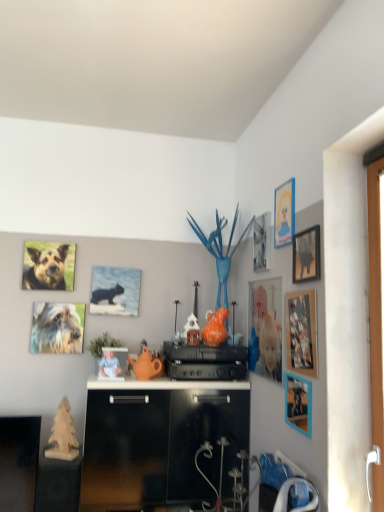
Describe the element at coordinates (46, 269) in the screenshot. The height and width of the screenshot is (512, 384). I see `brown fur dog at upper left, the 1th dog positioned from the top` at that location.

This screenshot has width=384, height=512. Find the location of `shaggy fur dog at upper left, positioned as the 2th dog in top-to-bottom order`. shaggy fur dog at upper left, positioned as the 2th dog in top-to-bottom order is located at coordinates (56, 329).

What is the approximate width of wooden picture frame at upper right, arranged as the 1th picture frame when viewed from the right?

0.86 inches.

Find the location of a particular element. black plastic stereo at center is located at coordinates point(205,361).

The image size is (384, 512). Describe the element at coordinates (265, 328) in the screenshot. I see `matte plastic picture frame at center-right, which is the 6th picture frame in right-to-left order` at that location.

The image size is (384, 512). In order to click on brown fur dog at upper left, the 1th dog positioned from the top in this screenshot , I will do `click(46, 269)`.

Consider the image. Considering the sizes of objects black plastic stereo at center and matte plastic picture frame at center-right, which is the 6th picture frame in right-to-left order, in the image provided, who is smaller, black plastic stereo at center or matte plastic picture frame at center-right, which is the 6th picture frame in right-to-left order,?

matte plastic picture frame at center-right, which is the 6th picture frame in right-to-left order, is smaller.

From a real-world perspective, is black plastic stereo at center positioned under matte plastic picture frame at center-right, the third picture frame from the left, based on gravity?

Yes.

Locate an element on the screen. The width and height of the screenshot is (384, 512). the 2nd picture frame above the black plastic stereo at center (from the image's perspective) is located at coordinates (265, 328).

Between wooden picture frame at right, arranged as the third picture frame when viewed from the right, and black plastic stereo at center, which one has larger width?

With larger width is black plastic stereo at center.

Is wooden picture frame at right, the sixth picture frame viewed from the left, directly adjacent to black plastic stereo at center?

No.

Considering the positions of points (294, 424) and (236, 365), is point (294, 424) farther from camera compared to point (236, 365)?

No.

Does wooden picture frame at right, arranged as the third picture frame when viewed from the right, have a smaller size compared to black plastic stereo at center?

Correct, wooden picture frame at right, arranged as the third picture frame when viewed from the right, occupies less space than black plastic stereo at center.

Consider the image. Which is farther, (375, 355) or (262, 243)?

The point (262, 243) is more distant.

Could you tell me if white plastic handle at right is facing metallic silver picture frame at upper right, which is counted as the fifth picture frame, starting from the right?

No, white plastic handle at right is not aimed at metallic silver picture frame at upper right, which is counted as the fifth picture frame, starting from the right.

From a real-world perspective, is white plastic handle at right over metallic silver picture frame at upper right, which is counted as the fifth picture frame, starting from the right?

Actually, white plastic handle at right is physically below metallic silver picture frame at upper right, which is counted as the fifth picture frame, starting from the right, in the real world.

Could you tell me if metallic silver picture frame at upper right, which is the fourth picture frame from left to right, is facing matte plastic picture frame at center, which is the 7th picture frame from right to left?

No, metallic silver picture frame at upper right, which is the fourth picture frame from left to right, does not turn towards matte plastic picture frame at center, which is the 7th picture frame from right to left.

Is metallic silver picture frame at upper right, which is counted as the fifth picture frame, starting from the right, bigger than matte plastic picture frame at center, which is the 7th picture frame from right to left?

Incorrect, metallic silver picture frame at upper right, which is counted as the fifth picture frame, starting from the right, is not larger than matte plastic picture frame at center, which is the 7th picture frame from right to left.

Can you confirm if metallic silver picture frame at upper right, which is counted as the fifth picture frame, starting from the right, is wider than matte plastic picture frame at center, which is the 7th picture frame from right to left?

Incorrect, the width of metallic silver picture frame at upper right, which is counted as the fifth picture frame, starting from the right, does not surpass that of matte plastic picture frame at center, which is the 7th picture frame from right to left.

How far apart are metallic silver picture frame at upper right, which is counted as the fifth picture frame, starting from the right, and matte plastic picture frame at center, which is the 7th picture frame from right to left?

metallic silver picture frame at upper right, which is counted as the fifth picture frame, starting from the right, is 1.02 meters away from matte plastic picture frame at center, which is the 7th picture frame from right to left.

Between shaggy fur dog at upper left, marked as the first dog in a bottom-to-top arrangement, and matte plastic picture frame at center-right, which is the 6th picture frame in right-to-left order, which one has smaller width?

matte plastic picture frame at center-right, which is the 6th picture frame in right-to-left order.

Can you confirm if shaggy fur dog at upper left, positioned as the 2th dog in top-to-bottom order, is smaller than matte plastic picture frame at center-right, which is the 6th picture frame in right-to-left order?

Indeed, shaggy fur dog at upper left, positioned as the 2th dog in top-to-bottom order, has a smaller size compared to matte plastic picture frame at center-right, which is the 6th picture frame in right-to-left order.

Is point (60, 313) closer or farther from the camera than point (256, 303)?

Point (60, 313) is farther from the camera than point (256, 303).

Looking at this image, from a real-world perspective, is shaggy fur dog at upper left, marked as the first dog in a bottom-to-top arrangement, beneath matte plastic picture frame at center-right, which is the 6th picture frame in right-to-left order?

Yes, from a real-world perspective, shaggy fur dog at upper left, marked as the first dog in a bottom-to-top arrangement, is beneath matte plastic picture frame at center-right, which is the 6th picture frame in right-to-left order.

Is matte plastic picture frame at center, which is the 7th picture frame from right to left, next to black plastic stereo at center and touching it?

No, matte plastic picture frame at center, which is the 7th picture frame from right to left, is not with black plastic stereo at center.

Is point (125, 364) positioned in front of point (172, 348)?

Yes, point (125, 364) is closer to viewer.

Is black plastic stereo at center located within matte plastic picture frame at center, which is the 7th picture frame from right to left?

No, black plastic stereo at center is located outside of matte plastic picture frame at center, which is the 7th picture frame from right to left.

Considering the relative sizes of matte plastic picture frame at center, which is the 7th picture frame from right to left, and black plastic stereo at center in the image provided, is matte plastic picture frame at center, which is the 7th picture frame from right to left, wider than black plastic stereo at center?

No.

Who is shorter, black plastic stereo at center or matte blue cat at upper center, which is counted as the 8th picture frame, starting from the right?

black plastic stereo at center.

Is black plastic stereo at center not near matte blue cat at upper center, which is counted as the first picture frame, starting from the left?

black plastic stereo at center is actually quite close to matte blue cat at upper center, which is counted as the first picture frame, starting from the left.

From a real-world perspective, between black plastic stereo at center and matte blue cat at upper center, which is counted as the 8th picture frame, starting from the right, who is vertically lower?

black plastic stereo at center.

Is black plastic stereo at center turned away from matte blue cat at upper center, which is counted as the first picture frame, starting from the left?

No, black plastic stereo at center's orientation is not away from matte blue cat at upper center, which is counted as the first picture frame, starting from the left.

Where is `the 2nd picture frame above the black plastic stereo at center (from the image's perspective)`? the 2nd picture frame above the black plastic stereo at center (from the image's perspective) is located at coordinates (265, 328).

Find the location of a particular element. This screenshot has width=384, height=512. appliance above the wooden picture frame at right, arranged as the third picture frame when viewed from the right (from a real-world perspective) is located at coordinates (205, 361).

In the scene shown: When comparing their distances from matte plastic picture frame at center, which is the 7th picture frame from right to left, does brown fur dog at upper left, the 1th dog positioned from the top, or matte blue cat at upper center, which is counted as the 8th picture frame, starting from the right, seem closer?

matte blue cat at upper center, which is counted as the 8th picture frame, starting from the right, is closer to matte plastic picture frame at center, which is the 7th picture frame from right to left.

Looking at the image, which one is located further to metallic silver picture frame at upper right, which is the fourth picture frame from left to right, matte blue cat at upper center, which is counted as the 8th picture frame, starting from the right, or wooden picture frame at right, the sixth picture frame viewed from the left?

Based on the image, matte blue cat at upper center, which is counted as the 8th picture frame, starting from the right, appears to be further to metallic silver picture frame at upper right, which is the fourth picture frame from left to right.

Considering their positions, is wooden photo frame at right, positioned as the second picture frame in right-to-left order, positioned further to white plastic handle at right than metallic silver picture frame at upper right, which is counted as the fifth picture frame, starting from the right?

metallic silver picture frame at upper right, which is counted as the fifth picture frame, starting from the right.

Which object lies nearer to the anchor point wooden picture frame at upper right, arranged as the 1th picture frame when viewed from the right, matte plastic picture frame at center, which is the 7th picture frame from right to left, or wooden picture frame at right, arranged as the third picture frame when viewed from the right?

Among the two, wooden picture frame at right, arranged as the third picture frame when viewed from the right, is located nearer to wooden picture frame at upper right, arranged as the 1th picture frame when viewed from the right.

Looking at the image, which one is located closer to matte plastic picture frame at center-right, the third picture frame from the left, shaggy fur dog at upper left, positioned as the 2th dog in top-to-bottom order, or metallic silver picture frame at upper right, which is counted as the fifth picture frame, starting from the right?

The object closer to matte plastic picture frame at center-right, the third picture frame from the left, is metallic silver picture frame at upper right, which is counted as the fifth picture frame, starting from the right.

When comparing their distances from white plastic handle at right, does metallic silver picture frame at upper right, which is counted as the fifth picture frame, starting from the right, or wooden photo frame at right, positioned as the second picture frame in right-to-left order, seem closer?

wooden photo frame at right, positioned as the second picture frame in right-to-left order, lies closer to white plastic handle at right than the other object.

Looking at the image, which one is located closer to black plastic stereo at center, wooden picture frame at upper right, arranged as the 1th picture frame when viewed from the right, or matte plastic picture frame at upper right, acting as the fourth picture frame starting from the right?

Among the two, matte plastic picture frame at upper right, acting as the fourth picture frame starting from the right, is located nearer to black plastic stereo at center.

When comparing their distances from metallic silver picture frame at upper right, which is the fourth picture frame from left to right, does wooden picture frame at upper right, which is the eighth picture frame in left-to-right order, or matte blue cat at upper center, which is counted as the first picture frame, starting from the left, seem further?

matte blue cat at upper center, which is counted as the first picture frame, starting from the left, is further to metallic silver picture frame at upper right, which is the fourth picture frame from left to right.

Where is `appliance situated between matte plastic picture frame at center, arranged as the second picture frame when viewed from the left, and matte plastic picture frame at center-right, the third picture frame from the left, from left to right`? Image resolution: width=384 pixels, height=512 pixels. appliance situated between matte plastic picture frame at center, arranged as the second picture frame when viewed from the left, and matte plastic picture frame at center-right, the third picture frame from the left, from left to right is located at coordinates (205, 361).

You are a GUI agent. You are given a task and a screenshot of the screen. Output one action in this format:
    pyautogui.click(x=<x>, y=<y>)
    Task: Click on the dog between brown fur dog at upper left, the 1th dog positioned from the top, and wooden picture frame at right, the sixth picture frame viewed from the left, in the horizontal direction
    The width and height of the screenshot is (384, 512).
    Given the screenshot: What is the action you would take?
    pyautogui.click(x=56, y=329)

You are a GUI agent. You are given a task and a screenshot of the screen. Output one action in this format:
    pyautogui.click(x=<x>, y=<y>)
    Task: Click on the appliance situated between shaggy fur dog at upper left, positioned as the 2th dog in top-to-bottom order, and wooden photo frame at right, arranged as the 7th picture frame when viewed from the left, from left to right
    The image size is (384, 512).
    Given the screenshot: What is the action you would take?
    pyautogui.click(x=205, y=361)

I want to click on dog between brown fur dog at upper left, the 1th dog positioned from the top, and matte plastic picture frame at upper right, acting as the fifth picture frame starting from the left, so pos(56,329).